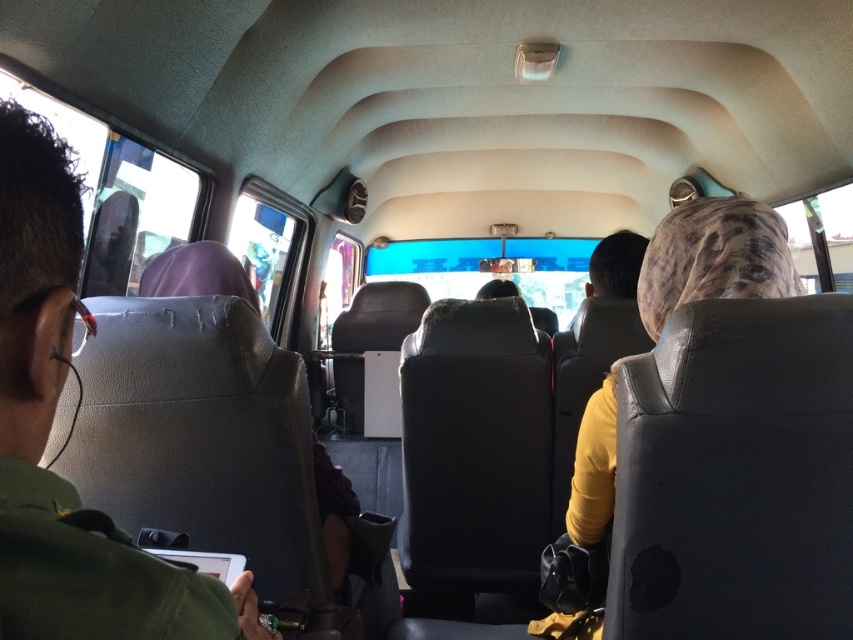
Can you confirm if green matte uniform at left is bigger than leather-like purple headscarf at left?

No.

Is point (210, 612) behind point (335, 545)?

No, it is not.

At what (x,y) coordinates should I click in order to perform the action: click on green matte uniform at left. Please return your answer as a coordinate pair (x, y). The width and height of the screenshot is (853, 640). Looking at the image, I should click on (49, 429).